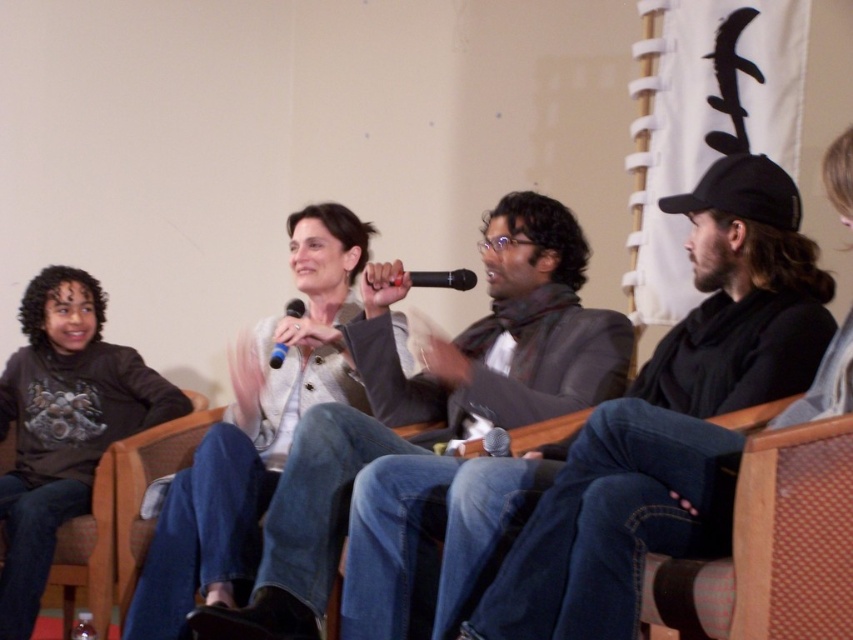
Question: Is white textured sweater at center below blue matte microphone at center?

Choices:
 (A) yes
 (B) no

Answer: (A)

Question: Among these objects, which one is nearest to the camera?

Choices:
 (A) matte gray sweater at center
 (B) matte gray jacket at center

Answer: (B)

Question: Is matte gray jacket at center positioned behind matte gray sweater at center?

Choices:
 (A) no
 (B) yes

Answer: (A)

Question: Which object is closer to the camera taking this photo?

Choices:
 (A) matte gray sweater at center
 (B) blue matte microphone at center

Answer: (A)

Question: Is matte gray jacket at center to the right of blue matte microphone at center from the viewer's perspective?

Choices:
 (A) yes
 (B) no

Answer: (A)

Question: Which of these objects is positioned farthest from the matte gray jacket at center?

Choices:
 (A) matte gray sweater at center
 (B) black matte microphone at center
 (C) blue matte microphone at center
 (D) white textured sweater at center

Answer: (A)